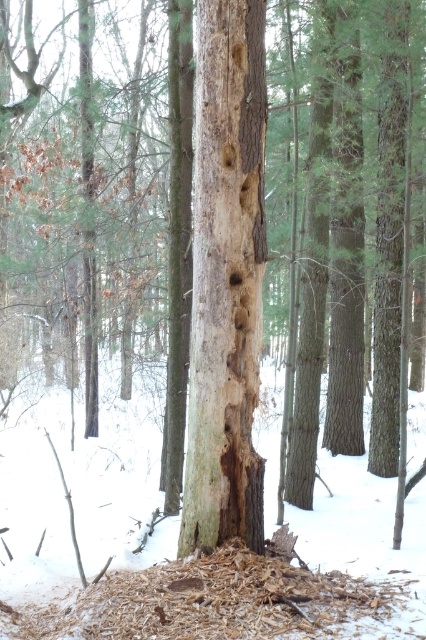
You are a small animal trying to find shelter from the cold. You see the white powdery snow at center and the light brown wood at center. Which one is closer to the ground?

The white powdery snow at center is located below the light brown wood at center, so the white powdery snow at center is closer to the ground.

Based on the scene description, can you determine if the white powdery snow at center is wider than the light brown wood at center?

The white powdery snow at center might be wider than light brown wood at center according to the description.